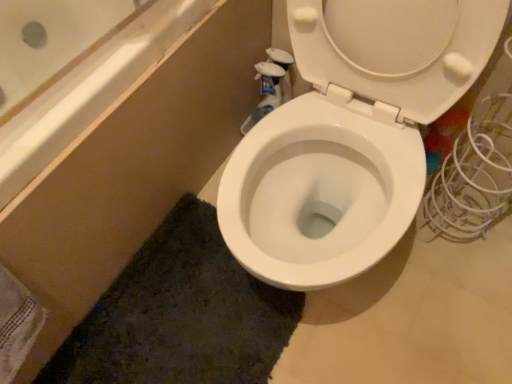
What do you see at coordinates (16, 324) in the screenshot?
I see `white textured towel at lower left` at bounding box center [16, 324].

Find the location of a particular element. The width and height of the screenshot is (512, 384). dark green textured bath mat at lower center is located at coordinates (180, 315).

This screenshot has height=384, width=512. I want to click on white glossy toilet at center, so click(x=350, y=135).

Image resolution: width=512 pixels, height=384 pixels. What are the coordinates of `white textured towel at lower left` in the screenshot? It's located at (16, 324).

Is dark green textured bath mat at lower center oriented away from white glossy toilet at center?

No, dark green textured bath mat at lower center is not facing away from white glossy toilet at center.

Identify the location of bath mat directly beneath the white glossy toilet at center (from a real-world perspective). (180, 315).

Can you confirm if dark green textured bath mat at lower center is positioned to the left of white glossy toilet at center?

Yes, dark green textured bath mat at lower center is to the left of white glossy toilet at center.

From a real-world perspective, is white textured towel at lower left positioned under dark green textured bath mat at lower center based on gravity?

Actually, white textured towel at lower left is physically above dark green textured bath mat at lower center in the real world.

From the image's perspective, does white textured towel at lower left appear higher than dark green textured bath mat at lower center?

Yes, from the image's perspective, white textured towel at lower left is above dark green textured bath mat at lower center.

Is there a large distance between white textured towel at lower left and dark green textured bath mat at lower center?

That's not correct — white textured towel at lower left is a little close to dark green textured bath mat at lower center.

Between point (1, 310) and point (126, 293), which one is positioned in front?

Point (1, 310)

Considering the relative sizes of dark green textured bath mat at lower center and white textured towel at lower left in the image provided, is dark green textured bath mat at lower center shorter than white textured towel at lower left?

Correct, dark green textured bath mat at lower center is not as tall as white textured towel at lower left.

Which point is more distant from viewer, (190,372) or (10,353)?

The point (190,372) is behind.

Between dark green textured bath mat at lower center and white textured towel at lower left, which one appears on the left side from the viewer's perspective?

white textured towel at lower left is more to the left.

Where is `bath mat that is on the right side of white textured towel at lower left`? This screenshot has height=384, width=512. bath mat that is on the right side of white textured towel at lower left is located at coordinates (180, 315).

Considering the relative positions of white glossy toilet at center and white textured towel at lower left in the image provided, is white glossy toilet at center to the right of white textured towel at lower left from the viewer's perspective?

Yes, white glossy toilet at center is to the right of white textured towel at lower left.

Is white glossy toilet at center next to white textured towel at lower left and touching it?

They are not placed beside each other.

Is white glossy toilet at center not within white textured towel at lower left?

white glossy toilet at center is positioned outside white textured towel at lower left.

Which is closer, (x=415, y=162) or (x=12, y=295)?

Point (x=415, y=162) appears to be farther away from the viewer than point (x=12, y=295).

Is white glossy toilet at center in front of dark green textured bath mat at lower center?

Yes.

Considering the relative sizes of white glossy toilet at center and dark green textured bath mat at lower center in the image provided, is white glossy toilet at center shorter than dark green textured bath mat at lower center?

No, white glossy toilet at center is not shorter than dark green textured bath mat at lower center.

Would you consider white glossy toilet at center to be distant from dark green textured bath mat at lower center?

Actually, white glossy toilet at center and dark green textured bath mat at lower center are a little close together.

From the image's perspective, is white glossy toilet at center under dark green textured bath mat at lower center?

No, from the image's perspective, white glossy toilet at center is not beneath dark green textured bath mat at lower center.

Who is smaller, white textured towel at lower left or white glossy toilet at center?

With smaller size is white textured towel at lower left.

Looking at this image, does white textured towel at lower left come behind white glossy toilet at center?

That is True.

Can you confirm if white textured towel at lower left is taller than white glossy toilet at center?

Incorrect, the height of white textured towel at lower left is not larger of that of white glossy toilet at center.

At what (x,y) coordinates should I click in order to perform the action: click on bath mat below the white glossy toilet at center (from a real-world perspective). Please return your answer as a coordinate pair (x, y). Looking at the image, I should click on (180, 315).

Where is `bath mat on the right side of white textured towel at lower left`? The image size is (512, 384). bath mat on the right side of white textured towel at lower left is located at coordinates (180, 315).

Consider the image. Which object lies further to the anchor point dark green textured bath mat at lower center, white glossy toilet at center or white textured towel at lower left?

Among the two, white glossy toilet at center is located further to dark green textured bath mat at lower center.

Which object lies further to the anchor point white textured towel at lower left, dark green textured bath mat at lower center or white glossy toilet at center?

Among the two, white glossy toilet at center is located further to white textured towel at lower left.

Based on their spatial positions, is white textured towel at lower left or white glossy toilet at center closer to dark green textured bath mat at lower center?

The object closer to dark green textured bath mat at lower center is white textured towel at lower left.

From the image, which object appears to be farther from white glossy toilet at center, dark green textured bath mat at lower center or white textured towel at lower left?

Among the two, white textured towel at lower left is located further to white glossy toilet at center.

From the image, which object appears to be nearer to white glossy toilet at center, white textured towel at lower left or dark green textured bath mat at lower center?

dark green textured bath mat at lower center is positioned closer to the anchor white glossy toilet at center.

When comparing their distances from white textured towel at lower left, does white glossy toilet at center or dark green textured bath mat at lower center seem further?

white glossy toilet at center is positioned further to the anchor white textured towel at lower left.

Locate an element on the screen. The image size is (512, 384). bath mat between white textured towel at lower left and white glossy toilet at center from left to right is located at coordinates (180, 315).